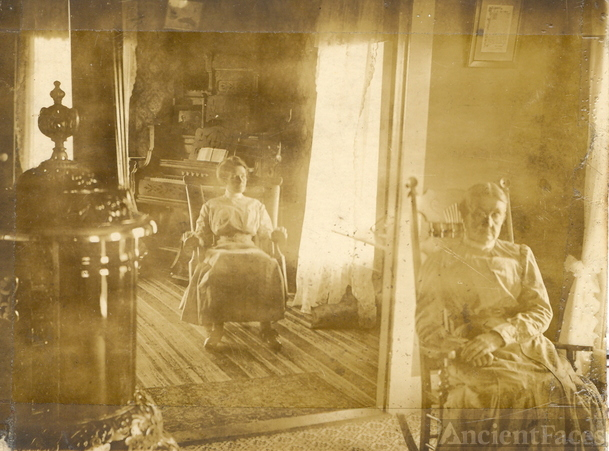
The image size is (609, 451). In order to click on tiled floor in this screenshot , I will do `click(342, 432)`.